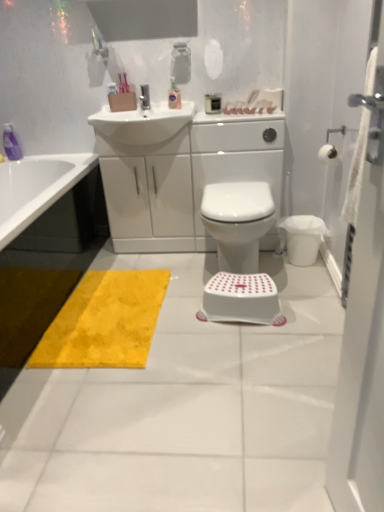
Question: Looking at the image, does white fabric screen door at right seem bigger or smaller compared to translucent plastic bottle at upper center?

Choices:
 (A) small
 (B) big

Answer: (B)

Question: From the image's perspective, is white fabric screen door at right located above or below translucent plastic bottle at upper center?

Choices:
 (A) above
 (B) below

Answer: (B)

Question: Which object is positioned closest to the white plastic step stool at center?

Choices:
 (A) white fabric screen door at right
 (B) metallic silver faucet at upper center
 (C) white glossy sink at upper center
 (D) yellow fuzzy rug at lower left
 (E) white plastic bidet at center

Answer: (E)

Question: Estimate the real-world distances between objects in this image. Which object is farther from the metallic silver faucet at upper center?

Choices:
 (A) white plastic bidet at center
 (B) white plastic step stool at center
 (C) white glossy sink at upper center
 (D) white matte toilet paper at upper right
 (E) translucent plastic bottle at upper center

Answer: (B)